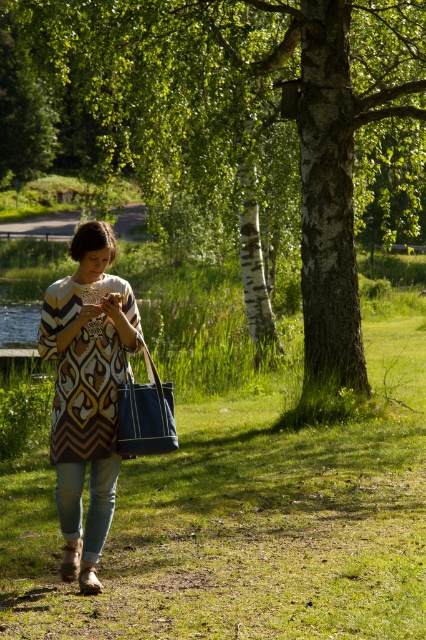
You are standing in the grassy area and want to walk from point A to point B. Point A is at coordinates point [28,173] and point B is at coordinates point [51,339]. Which point is closer to you?

Point A at coordinates point [28,173] is closer to you because it is further to the viewer than point B at coordinates point [51,339].